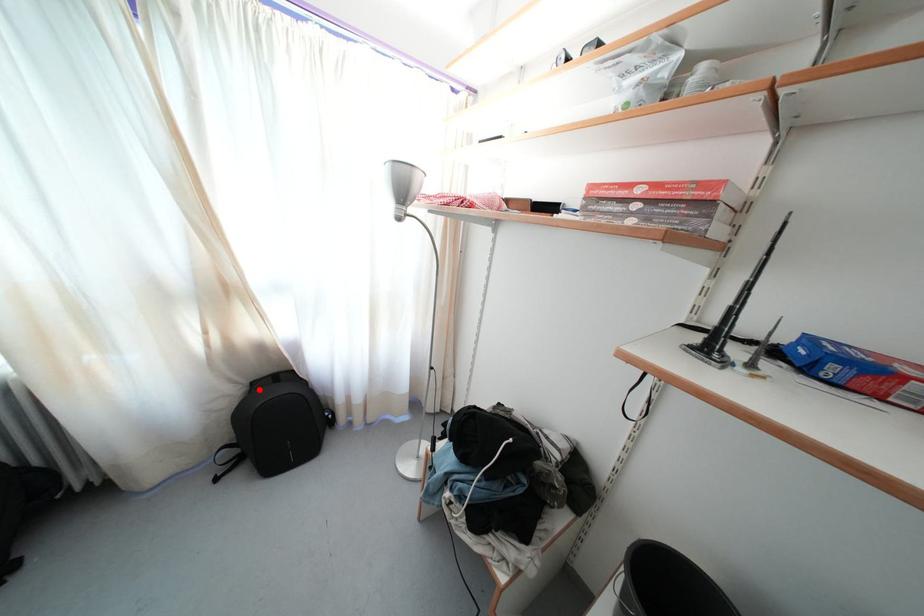
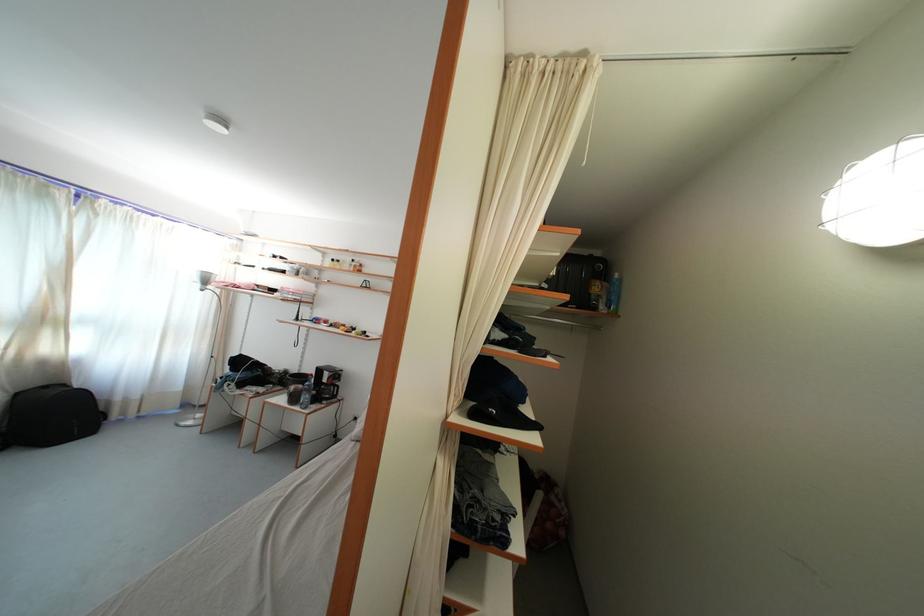
Question: I am providing you with two images of the same scene from different viewpoints. A red point is shown in image1. For the corresponding object point in image2, is it positioned nearer or farther from the camera?

Choices:
 (A) Nearer
 (B) Farther

Answer: (B)